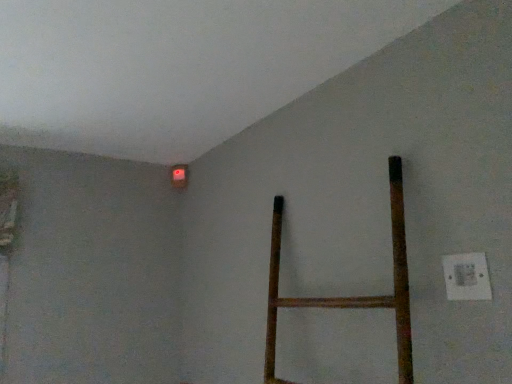
Question: Is white plastic electric outlet at lower right at the right side of matte orange light at upper left?

Choices:
 (A) no
 (B) yes

Answer: (B)

Question: From the image's perspective, is white plastic electric outlet at lower right located above matte orange light at upper left?

Choices:
 (A) no
 (B) yes

Answer: (A)

Question: Is white plastic electric outlet at lower right behind matte orange light at upper left?

Choices:
 (A) yes
 (B) no

Answer: (B)

Question: From the image's perspective, does white plastic electric outlet at lower right appear lower than matte orange light at upper left?

Choices:
 (A) no
 (B) yes

Answer: (B)

Question: Are white plastic electric outlet at lower right and matte orange light at upper left beside each other?

Choices:
 (A) yes
 (B) no

Answer: (B)

Question: Can we say white plastic electric outlet at lower right lies outside matte orange light at upper left?

Choices:
 (A) no
 (B) yes

Answer: (B)

Question: Is matte orange light at upper left turned away from white plastic electric outlet at lower right?

Choices:
 (A) no
 (B) yes

Answer: (A)

Question: Is matte orange light at upper left in front of white plastic electric outlet at lower right?

Choices:
 (A) yes
 (B) no

Answer: (B)

Question: Is matte orange light at upper left touching white plastic electric outlet at lower right?

Choices:
 (A) no
 (B) yes

Answer: (A)

Question: Is the depth of matte orange light at upper left greater than that of white plastic electric outlet at lower right?

Choices:
 (A) yes
 (B) no

Answer: (A)

Question: Is matte orange light at upper left located outside white plastic electric outlet at lower right?

Choices:
 (A) yes
 (B) no

Answer: (A)

Question: Considering the relative sizes of matte orange light at upper left and white plastic electric outlet at lower right in the image provided, is matte orange light at upper left wider than white plastic electric outlet at lower right?

Choices:
 (A) yes
 (B) no

Answer: (A)

Question: Looking at their shapes, would you say matte orange light at upper left is wider or thinner than white plastic electric outlet at lower right?

Choices:
 (A) wide
 (B) thin

Answer: (A)